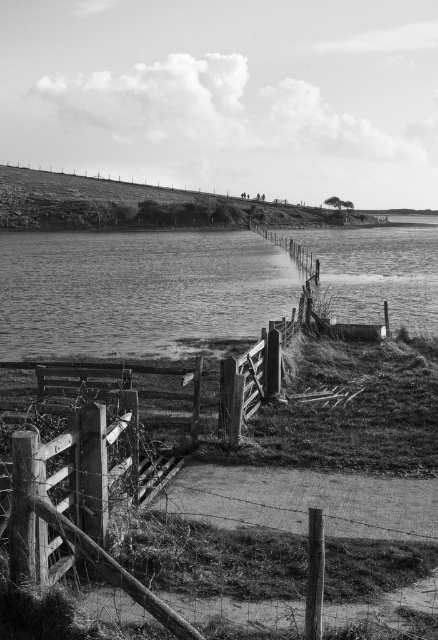
Is smooth water at lower left thinner than wooden gate at lower left?

A: Incorrect, smooth water at lower left's width is not less than wooden gate at lower left's.

Who is shorter, smooth water at lower left or wooden gate at lower left?

wooden gate at lower left is shorter.

Which is in front, point (283, 314) or point (63, 560)?

Point (63, 560) is more forward.

This screenshot has height=640, width=438. Identify the location of smooth water at lower left. (138, 291).